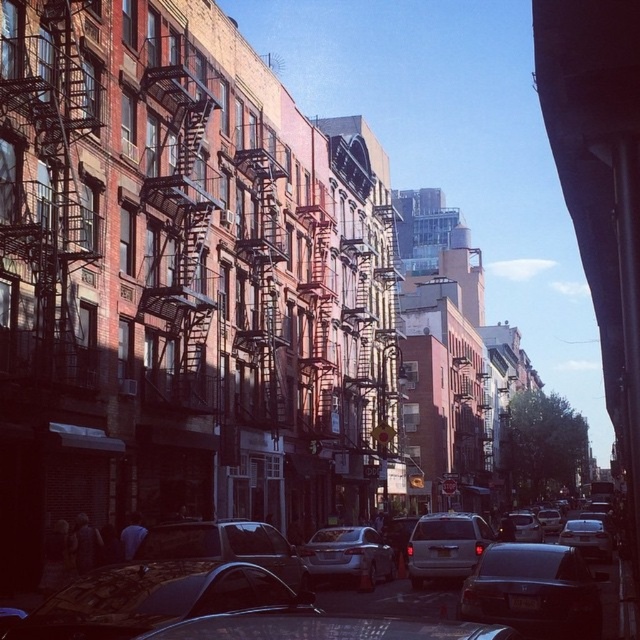
You are a delivery driver who needs to park your vehicle in this area. You have a delivery van that is 5 meters long. The shiny black car at lower left and the satin silver sedan at lower right are already parked here. Which vehicle should you avoid parking next to if you want to leave enough space for your van to maneuver?

You should avoid parking next to the satin silver sedan at lower right because it is larger than the shiny black car at lower left, leaving less space for your van to maneuver.

You are a delivery driver who needs to park your truck between the shiny black sedan at center and the satin silver sedan at center. Your truck is 2.5 meters wide. Can you fit your truck between them?

The shiny black sedan at center might be wider than satin silver sedan at center, but without knowing the exact width difference, it is uncertain whether the space between them can accommodate a 2.5 meter wide truck. You should measure the space first before attempting to park.

You are a pedestrian standing at the center of the street looking towards the buildings. Which car, the shiny black car at lower left or the satin silver sedan at lower right, is closer to the buildings?

The shiny black car at lower left is closer to the buildings because it is positioned above the satin silver sedan at lower right, indicating it is nearer in the visual perspective.